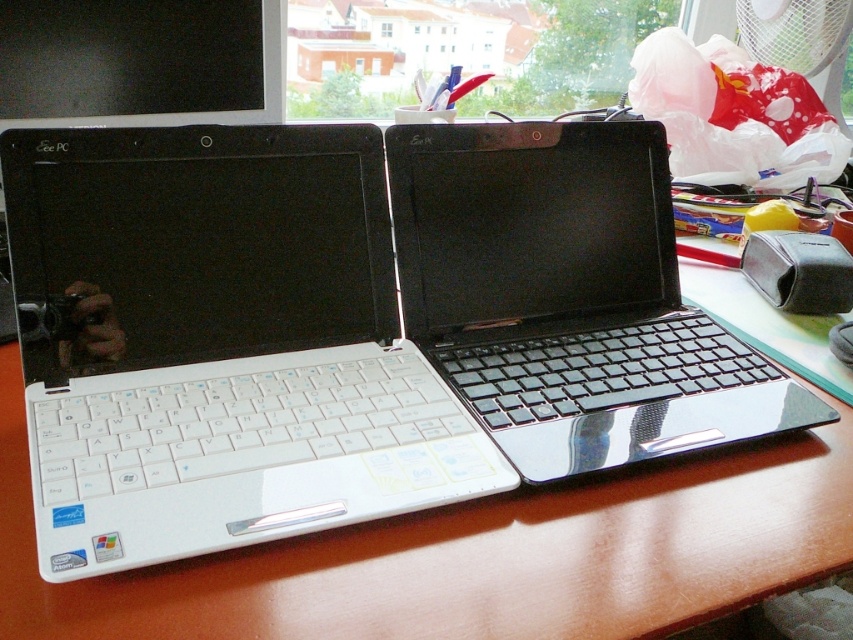
Is white glossy laptop at left thinner than glossy black laptop at center?

In fact, white glossy laptop at left might be wider than glossy black laptop at center.

Who is more forward, [22,294] or [653,310]?

Positioned in front is point [22,294].

Does point (253, 280) come behind point (459, 128)?

No, (253, 280) is closer to viewer.

Identify the location of white glossy laptop at left. The image size is (853, 640). (221, 344).

Is white glossy laptop at left shorter than wooden at center?

In fact, white glossy laptop at left may be taller than wooden at center.

Is white glossy laptop at left wider than wooden at center?

No.

Does point (285, 308) lie in front of point (759, 556)?

No, (285, 308) is behind (759, 556).

Identify the location of white glossy laptop at left. (221, 344).

Does wooden at center have a larger size compared to glossy black laptop at center?

Answer: Yes, wooden at center is bigger than glossy black laptop at center.

Is point (619, 481) positioned behind point (503, 336)?

That is False.

You are a GUI agent. You are given a task and a screenshot of the screen. Output one action in this format:
    pyautogui.click(x=<x>, y=<y>)
    Task: Click on the wooden at center
    
    Given the screenshot: What is the action you would take?
    pyautogui.click(x=473, y=554)